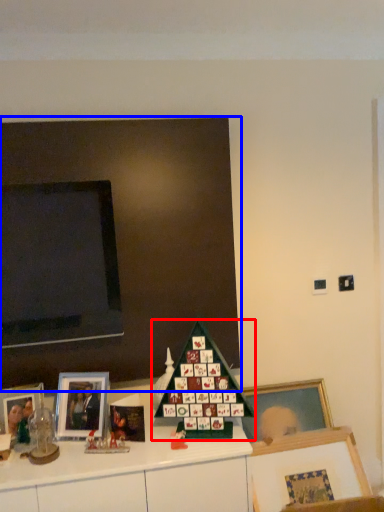
Question: Among these objects, which one is farthest to the camera, christmas tree (highlighted by a red box) or bulletin board (highlighted by a blue box)?

Choices:
 (A) christmas tree
 (B) bulletin board

Answer: (B)